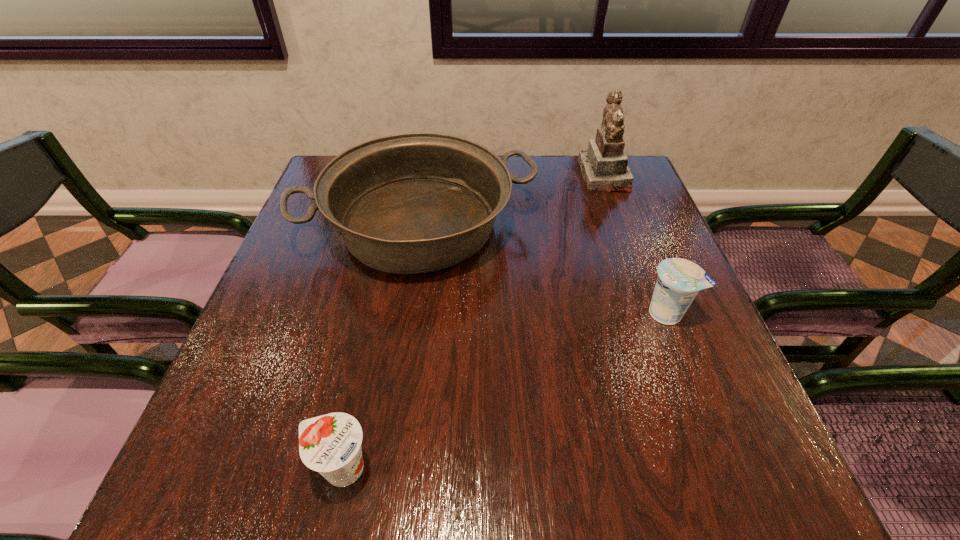
Identify the location of vacant region at the far edge of the desktop. Image resolution: width=960 pixels, height=540 pixels. (517, 176).

At what (x,y) coordinates should I click in order to perform the action: click on free space at the left edge of the desktop. Please return your answer as a coordinate pair (x, y). The height and width of the screenshot is (540, 960). Looking at the image, I should click on (317, 254).

You are a GUI agent. You are given a task and a screenshot of the screen. Output one action in this format:
    pyautogui.click(x=<x>, y=<y>)
    Task: Click on the vacant space at the right edge of the desktop
    Image resolution: width=960 pixels, height=540 pixels.
    Given the screenshot: What is the action you would take?
    pyautogui.click(x=715, y=399)

This screenshot has height=540, width=960. In order to click on free space at the near left corner of the desktop in this screenshot , I will do `click(173, 502)`.

Identify the location of vacant region at the near right corner of the desktop. This screenshot has height=540, width=960. (713, 482).

Find the location of a particular element. The height and width of the screenshot is (540, 960). free space between the tallest object and the third shortest object is located at coordinates (512, 201).

The height and width of the screenshot is (540, 960). I want to click on empty space that is in between the shortest object and the farther yogurt, so (505, 391).

In order to click on vacant region between the tallest object and the third tallest object in this screenshot , I will do `click(636, 245)`.

Locate an element on the screen. free space between the third shortest object and the shortest object is located at coordinates (381, 347).

The width and height of the screenshot is (960, 540). Identify the location of vacant region between the left yogurt and the second tallest object. (381, 347).